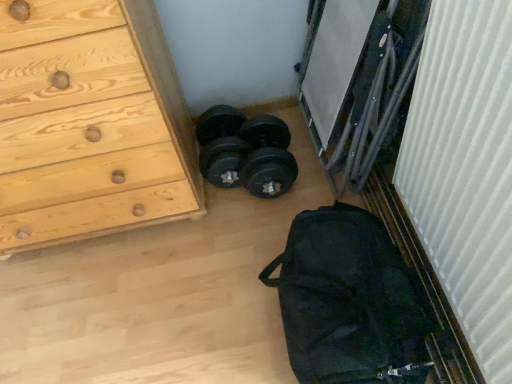
Question: Is point (294, 294) positioned closer to the camera than point (111, 162)?

Choices:
 (A) closer
 (B) farther

Answer: (A)

Question: Is black fabric bag at lower right wider or thinner than natural wood chest of drawers at left?

Choices:
 (A) thin
 (B) wide

Answer: (B)

Question: Based on their relative distances, which object is nearer to the natural wood chest of drawers at left?

Choices:
 (A) white ribbed curtain at right
 (B) black fabric bag at lower right
 (C) black rubber dumbbells at center

Answer: (C)

Question: Estimate the real-world distances between objects in this image. Which object is farther from the natural wood chest of drawers at left?

Choices:
 (A) white ribbed curtain at right
 (B) black rubber dumbbells at center
 (C) black fabric bag at lower right

Answer: (A)